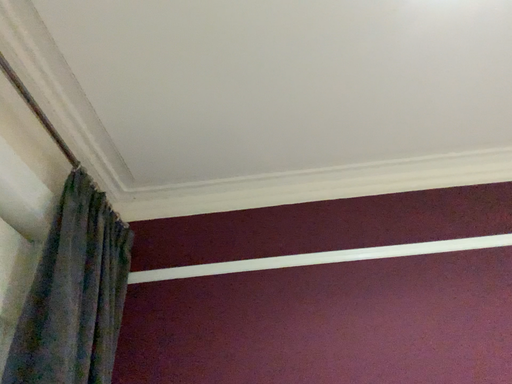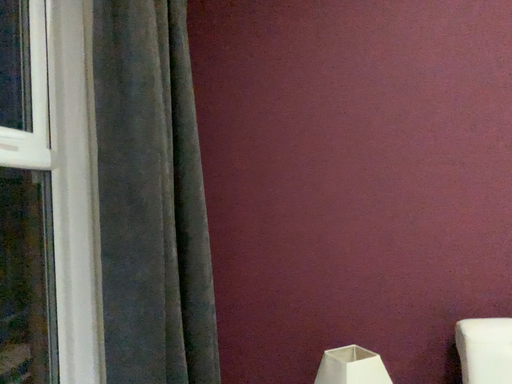
Question: How did the camera likely rotate when shooting the video?

Choices:
 (A) rotated upward
 (B) rotated downward

Answer: (B)